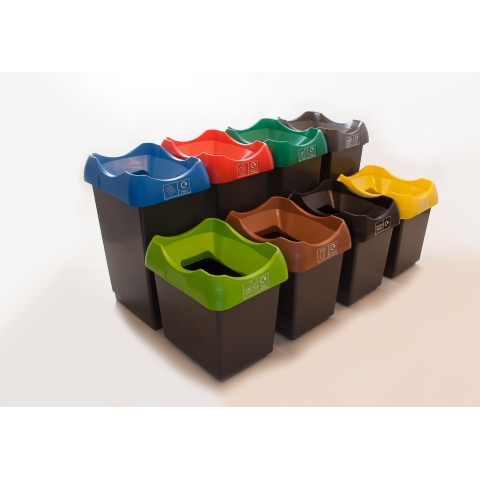
You are a GUI agent. You are given a task and a screenshot of the screen. Output one action in this format:
    pyautogui.click(x=<x>, y=<y>)
    Task: Click on the short recycling bin
    This screenshot has width=480, height=480.
    Given the screenshot: What is the action you would take?
    pyautogui.click(x=411, y=244), pyautogui.click(x=371, y=273), pyautogui.click(x=321, y=289), pyautogui.click(x=246, y=326)